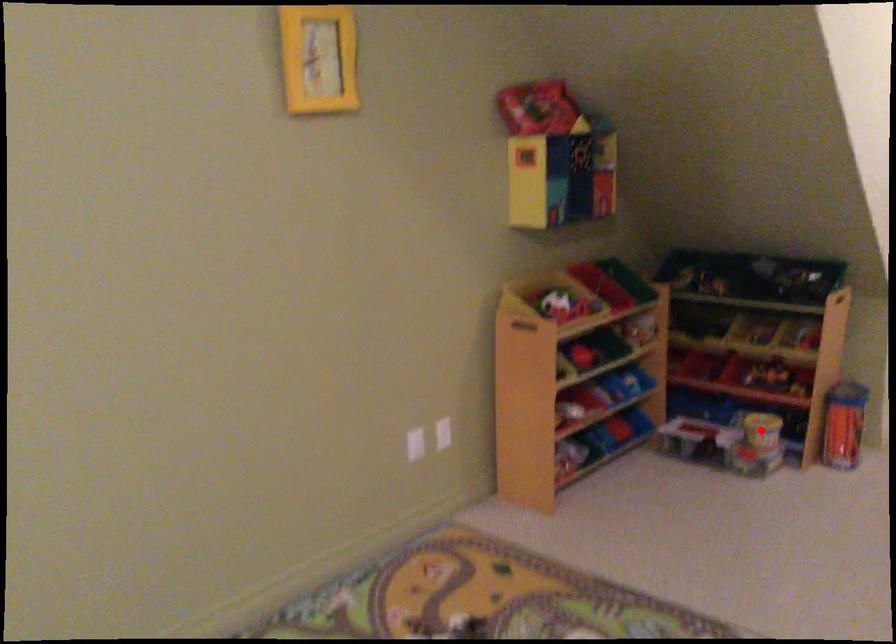
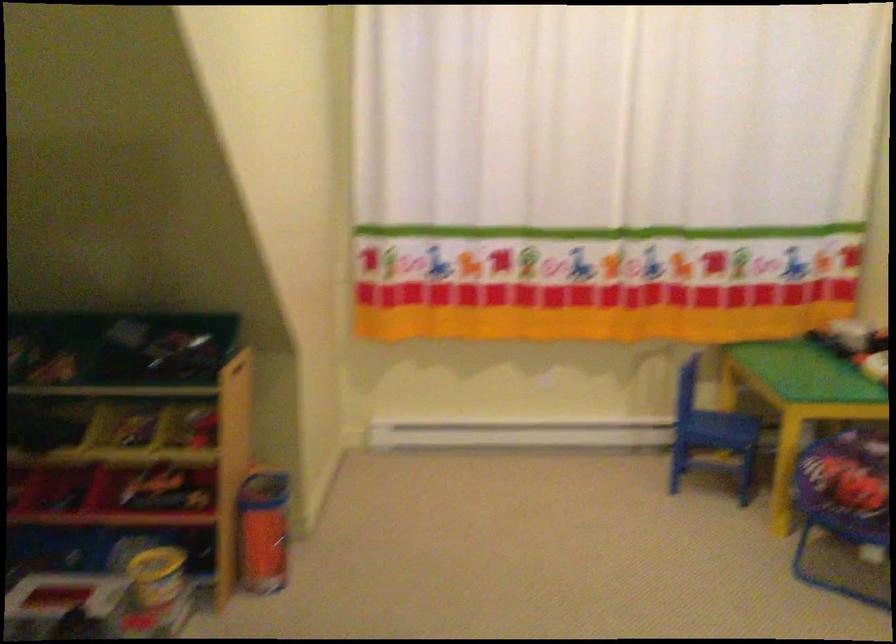
Find the pixel in the second image that matches the highlighted location in the first image.

(156, 576)